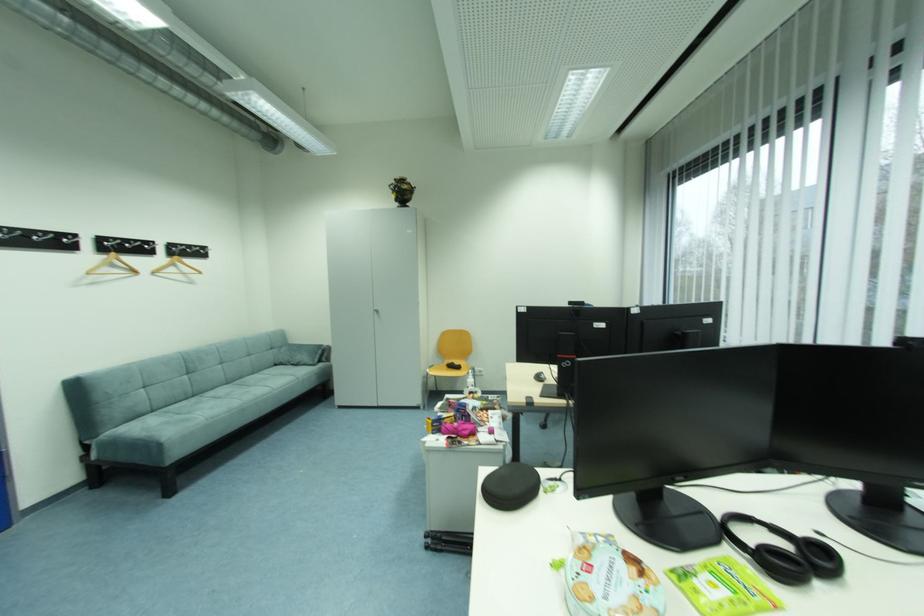
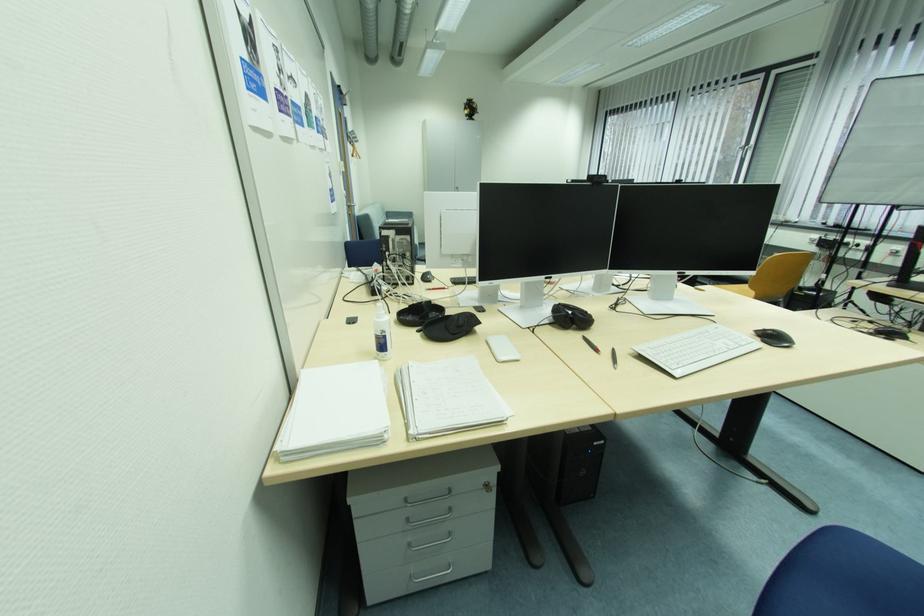
The images are taken continuously from a first-person perspective. In which direction are you moving?

The cameraman walked toward left, backward.